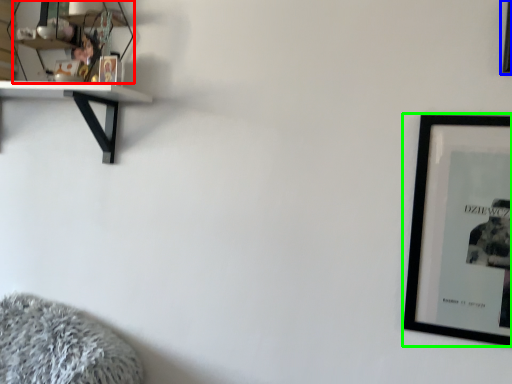
Question: Estimate the real-world distances between objects in this image. Which object is farther from shelf (highlighted by a red box), picture frame (highlighted by a blue box) or picture frame (highlighted by a green box)?

Choices:
 (A) picture frame
 (B) picture frame

Answer: (A)